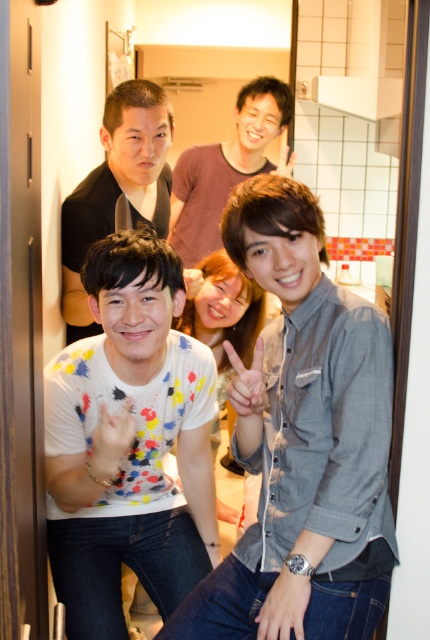
Question: Can you confirm if gray cotton shirt at center is positioned to the left of black matte shirt at upper center?

Choices:
 (A) yes
 (B) no

Answer: (B)

Question: Which point appears closest to the camera in this image?

Choices:
 (A) (114, 564)
 (B) (187, 218)
 (C) (323, 465)
 (D) (71, 221)

Answer: (C)

Question: Is gray cotton shirt at center below black matte shirt at upper center?

Choices:
 (A) yes
 (B) no

Answer: (A)

Question: Which is farther from the gray cotton shirt at center?

Choices:
 (A) white paint splattered shirt at center
 (B) black matte shirt at upper center

Answer: (B)

Question: Which point is farther from the camera taking this photo?

Choices:
 (A) [110, 221]
 (B) [197, 540]
 (C) [251, 621]
 (D) [196, 218]

Answer: (D)

Question: Can you confirm if white paint splattered shirt at center is smaller than matte gray shirt at center?

Choices:
 (A) yes
 (B) no

Answer: (A)